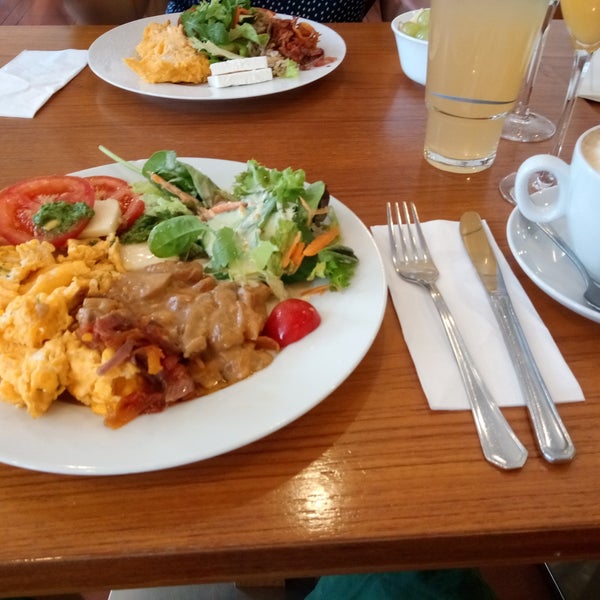
This screenshot has height=600, width=600. In order to click on handle in this screenshot , I will do `click(551, 161)`, `click(491, 421)`, `click(555, 421)`, `click(549, 230)`.